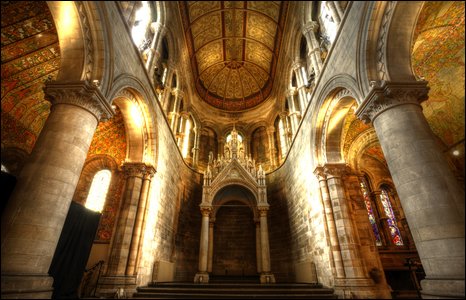
This screenshot has height=300, width=466. I want to click on bright lights, so click(x=137, y=122), click(x=66, y=23), click(x=328, y=110).